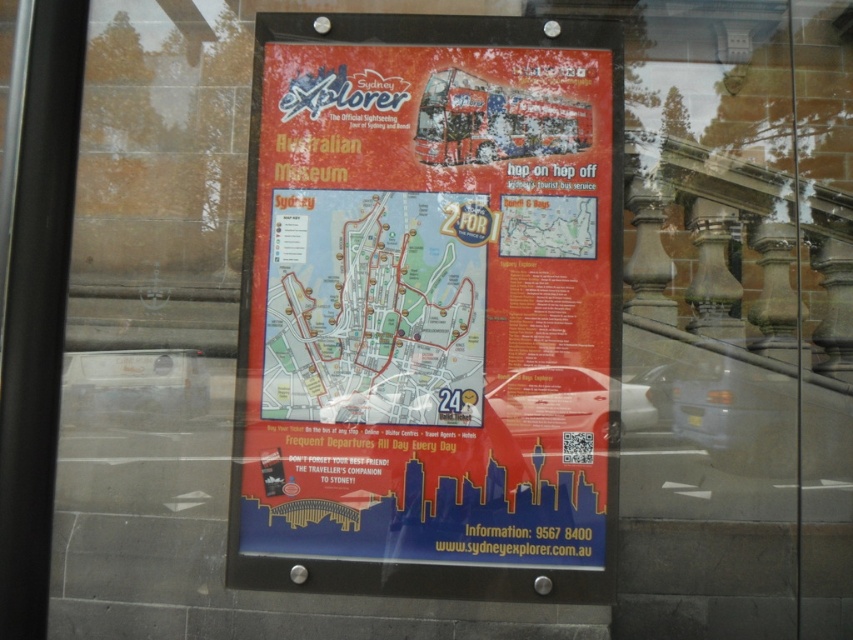
Question: Is red matte poster at center smaller than blue paper map at center?

Choices:
 (A) no
 (B) yes

Answer: (A)

Question: Can you confirm if red matte poster at center is positioned above blue paper map at center?

Choices:
 (A) yes
 (B) no

Answer: (A)

Question: Which point is farther to the camera?

Choices:
 (A) red matte poster at center
 (B) blue paper map at center

Answer: (B)

Question: Which point is farther to the camera?

Choices:
 (A) blue paper map at center
 (B) red matte poster at center

Answer: (A)

Question: Is red matte poster at center further to the viewer compared to blue paper map at center?

Choices:
 (A) no
 (B) yes

Answer: (A)

Question: Which object is farther from the camera taking this photo?

Choices:
 (A) blue paper map at center
 (B) red matte poster at center

Answer: (A)